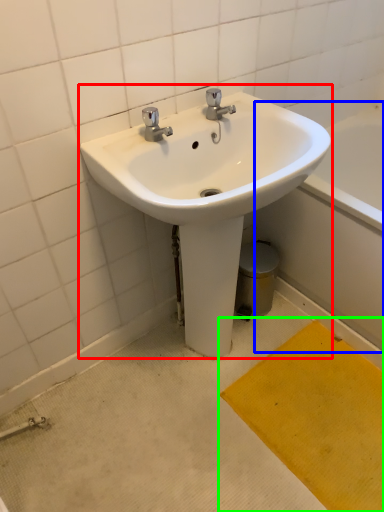
Question: Which object is positioned closest to sink (highlighted by a red box)? Select from bath (highlighted by a blue box) and doormat (highlighted by a green box).

Choices:
 (A) bath
 (B) doormat

Answer: (A)